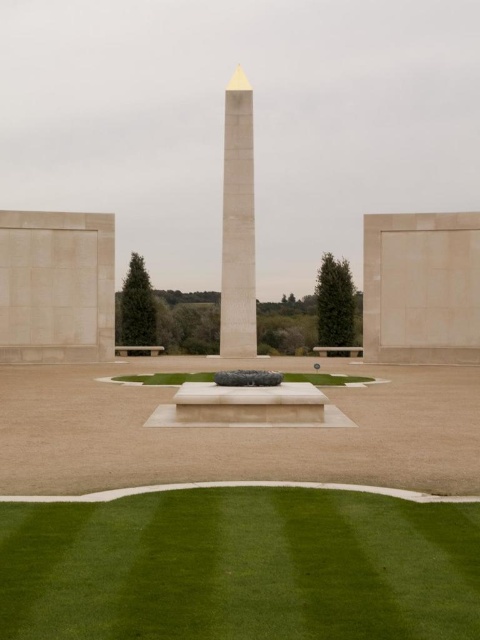
Question: Which object is closer to the camera taking this photo?

Choices:
 (A) green grass at center
 (B) beige stone wall at right
 (C) beige stone wall at left

Answer: (A)

Question: Can you confirm if beige stone wall at right is bigger than green grass at center?

Choices:
 (A) yes
 (B) no

Answer: (A)

Question: Is white polished stone obelisk at center positioned in front of green grass at center?

Choices:
 (A) no
 (B) yes

Answer: (A)

Question: Which of the following is the farthest from the observer?

Choices:
 (A) white polished stone obelisk at center
 (B) green smooth lawn at center
 (C) green grass at center
 (D) beige stone wall at left

Answer: (A)

Question: Can you confirm if beige stone wall at right is positioned to the left of beige stone wall at left?

Choices:
 (A) no
 (B) yes

Answer: (A)

Question: Which of the following is the closest to the observer?

Choices:
 (A) green smooth lawn at center
 (B) white polished stone obelisk at center
 (C) beige stone wall at left

Answer: (A)